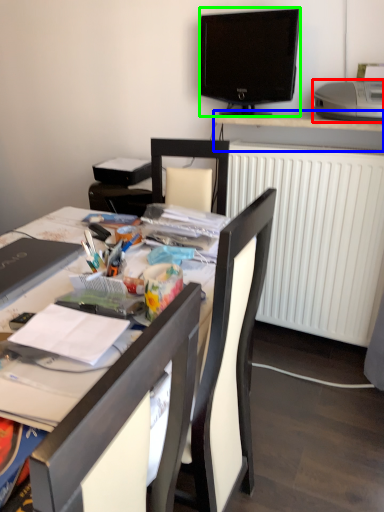
Question: Based on their relative distances, which object is nearer to printer (highlighted by a red box)? Choose from desk (highlighted by a blue box) and television (highlighted by a green box).

Choices:
 (A) desk
 (B) television

Answer: (A)